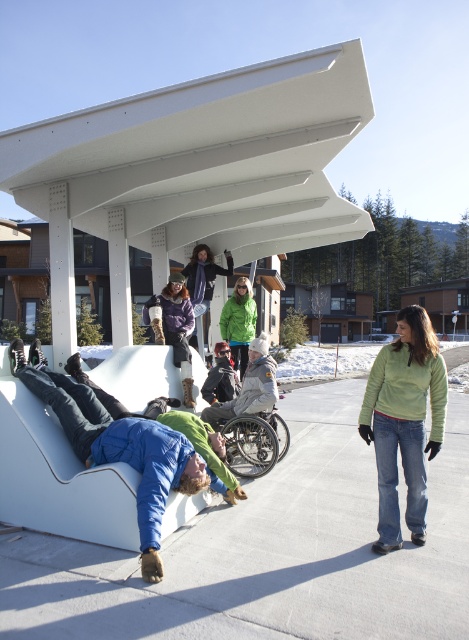
You are standing at the center of the scene and want to find the green fleece jacket at lower right. According to the coordinates provided, in which direction should you look to locate it?

The green fleece jacket at lower right is located at coordinates point [403,420], which means it is positioned to the right and slightly downward from the center of the scene. You should look towards the lower right direction to find it.